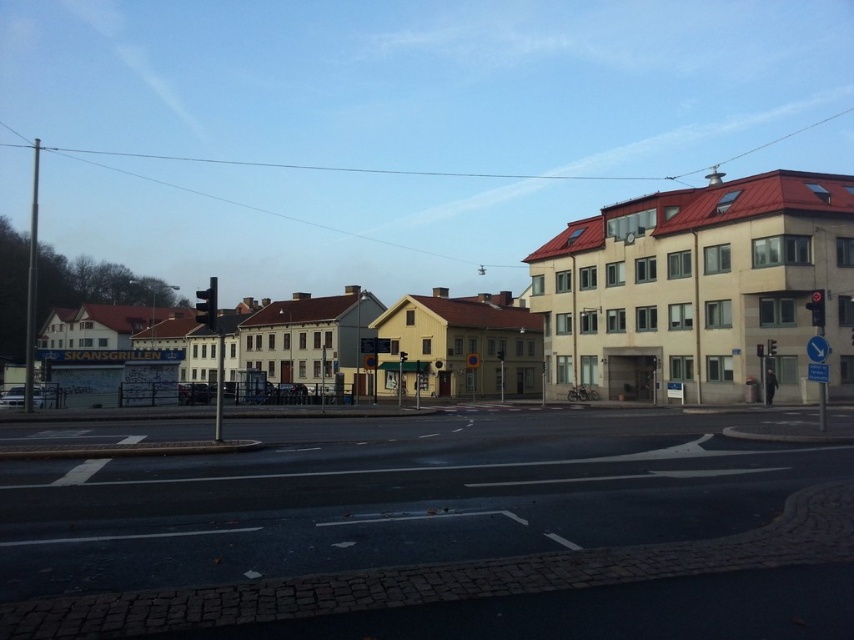
Question: Which object appears closest to the camera in this image?

Choices:
 (A) red glass traffic light at right
 (B) red glass traffic light at upper center

Answer: (A)

Question: Is red glass traffic light at right positioned behind red glass traffic light at upper center?

Choices:
 (A) no
 (B) yes

Answer: (A)

Question: Considering the real-world distances, which object is closest to the metallic traffic light at left?

Choices:
 (A) red glass traffic light at right
 (B) red glass traffic light at upper center

Answer: (B)

Question: Does red glass traffic light at right appear over red glass traffic light at upper center?

Choices:
 (A) yes
 (B) no

Answer: (A)

Question: Where is metallic traffic light at left located in relation to red glass traffic light at right in the image?

Choices:
 (A) left
 (B) right

Answer: (A)

Question: Which point is farther to the camera?

Choices:
 (A) red glass traffic light at upper center
 (B) red glass traffic light at right
 (C) metallic traffic light at left

Answer: (A)